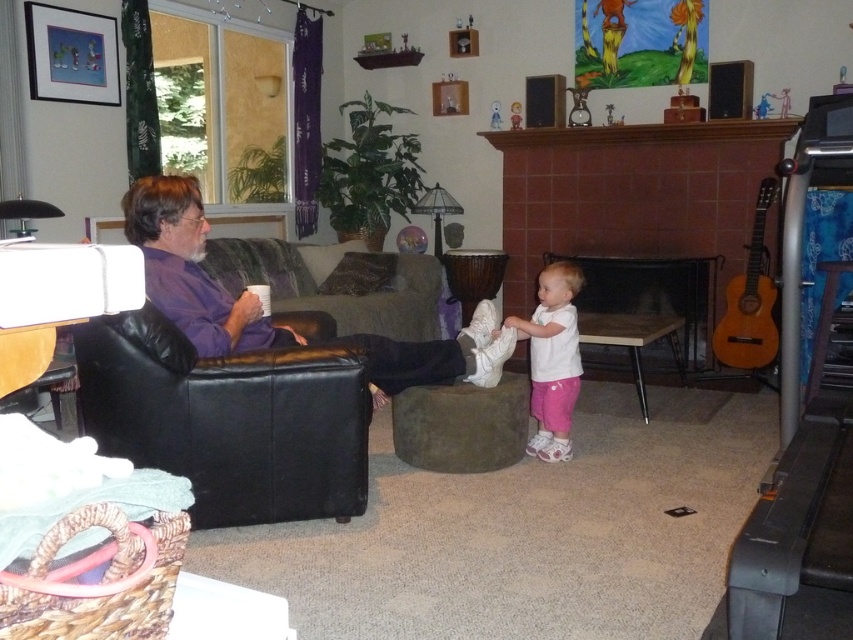
You are standing in the living room and want to sit down. There is a black leather bean bag chair at left. Can you walk directly to it from your current position without moving any furniture?

Yes, you can walk directly to the black leather bean bag chair at left without moving any furniture because its position is at point (228, 419), which is accessible.

You are a painter who needs to place a 1.2 meter wide painting between the brown tile fireplace at center and the white matte shirt at center. Can the space between them accommodate the painting?

The brown tile fireplace at center might be wider than white matte shirt at center, but without exact measurements, it is uncertain if the space between them can fit a 1.2 meter wide painting. Please verify the actual dimensions before deciding.